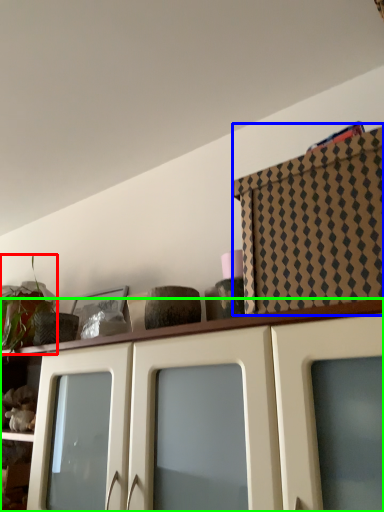
Question: Which is farther away from plant (highlighted by a red box)? cabinetry (highlighted by a blue box) or cabinetry (highlighted by a green box)?

Choices:
 (A) cabinetry
 (B) cabinetry

Answer: (A)